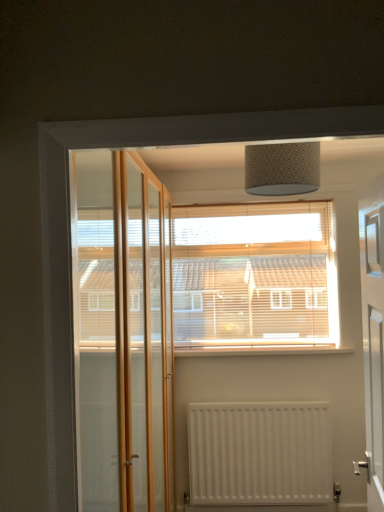
Question: Is white glossy door at right at the right side of white painted wood at center?

Choices:
 (A) no
 (B) yes

Answer: (B)

Question: Would you say white glossy door at right is outside white painted wood at center?

Choices:
 (A) no
 (B) yes

Answer: (B)

Question: Does white glossy door at right have a smaller size compared to white painted wood at center?

Choices:
 (A) yes
 (B) no

Answer: (B)

Question: Is white glossy door at right not near white painted wood at center?

Choices:
 (A) no
 (B) yes

Answer: (A)

Question: Considering the relative sizes of white glossy door at right and white painted wood at center in the image provided, is white glossy door at right bigger than white painted wood at center?

Choices:
 (A) yes
 (B) no

Answer: (A)

Question: Is point (324, 344) positioned closer to the camera than point (203, 418)?

Choices:
 (A) farther
 (B) closer

Answer: (A)

Question: From the image's perspective, is white painted wood at center located above or below white matte radiator at lower center?

Choices:
 (A) below
 (B) above

Answer: (B)

Question: From their relative heights in the image, would you say white painted wood at center is taller or shorter than white matte radiator at lower center?

Choices:
 (A) short
 (B) tall

Answer: (A)

Question: Which is correct: white painted wood at center is inside white matte radiator at lower center, or outside of it?

Choices:
 (A) outside
 (B) inside

Answer: (A)

Question: In terms of height, does white glossy door at right look taller or shorter compared to wooden blinds at center?

Choices:
 (A) short
 (B) tall

Answer: (B)

Question: Considering the positions of white glossy door at right and wooden blinds at center in the image, is white glossy door at right bigger or smaller than wooden blinds at center?

Choices:
 (A) small
 (B) big

Answer: (B)

Question: From the image's perspective, is white glossy door at right positioned above or below wooden blinds at center?

Choices:
 (A) above
 (B) below

Answer: (B)

Question: Relative to wooden blinds at center, is white glossy door at right in front or behind?

Choices:
 (A) front
 (B) behind

Answer: (A)

Question: From their relative heights in the image, would you say wooden blinds at center is taller or shorter than white glossy door at right?

Choices:
 (A) tall
 (B) short

Answer: (B)

Question: Considering their positions, is wooden blinds at center located in front of or behind white glossy door at right?

Choices:
 (A) behind
 (B) front

Answer: (A)